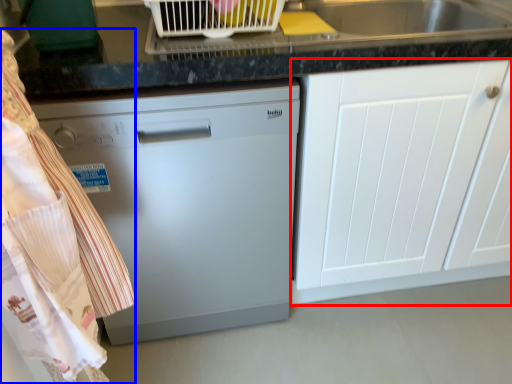
Question: Which object is further to the camera taking this photo, cabinetry (highlighted by a red box) or laundry (highlighted by a blue box)?

Choices:
 (A) cabinetry
 (B) laundry

Answer: (A)